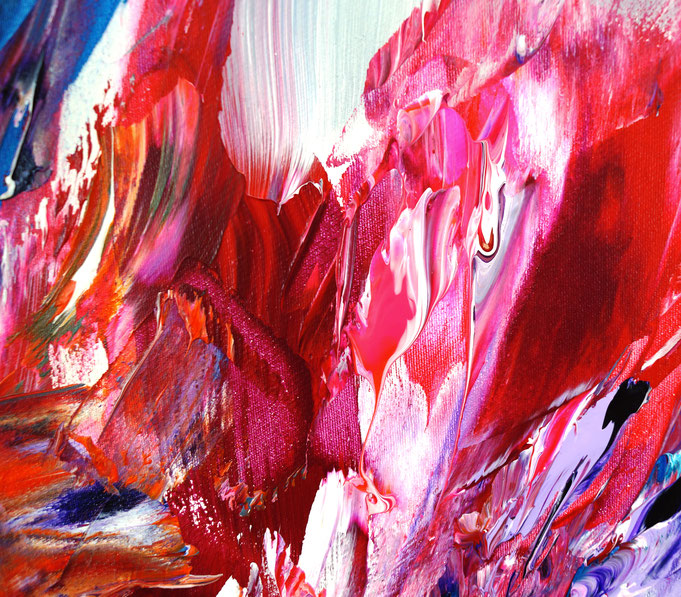
Where is `red paint`? The image size is (681, 597). red paint is located at coordinates (263, 340), (272, 407).